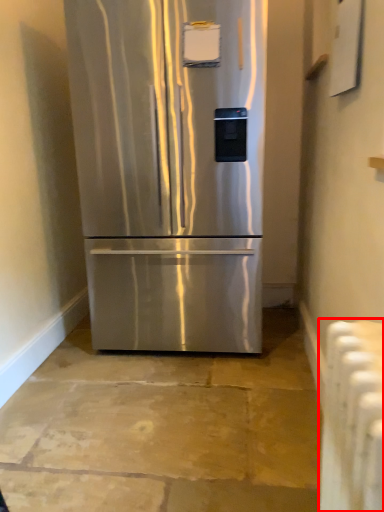
Question: From the image's perspective, considering the relative positions of radiator (annotated by the red box) and refrigerator in the image provided, where is radiator (annotated by the red box) located with respect to the staircase?

Choices:
 (A) above
 (B) below

Answer: (B)